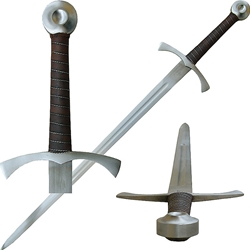
Identify the location of handles. The height and width of the screenshot is (250, 250). (63, 76), (205, 47).